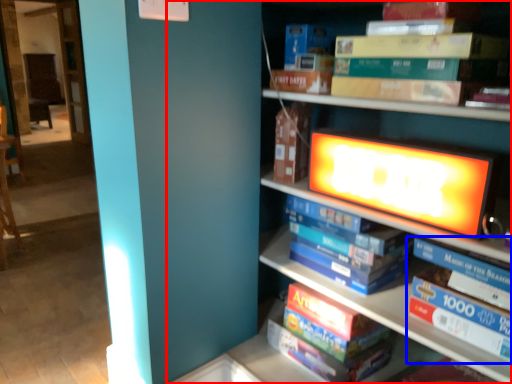
Question: Which of the following is the farthest to the observer, bookcase (highlighted by a red box) or book (highlighted by a blue box)?

Choices:
 (A) bookcase
 (B) book

Answer: (B)